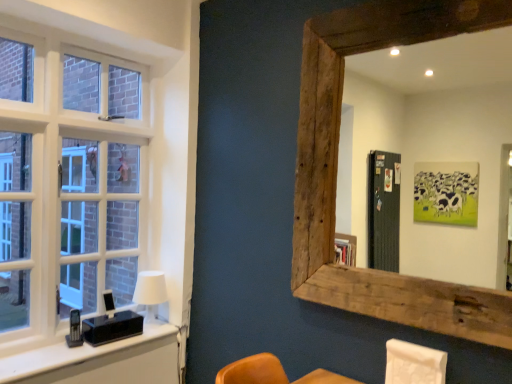
Question: Does white matte table lamp at left appear on the left side of rustic wood mirror at upper right?

Choices:
 (A) yes
 (B) no

Answer: (A)

Question: Is rustic wood mirror at upper right located within white matte table lamp at left?

Choices:
 (A) no
 (B) yes

Answer: (A)

Question: Is white matte table lamp at left bigger than rustic wood mirror at upper right?

Choices:
 (A) yes
 (B) no

Answer: (B)

Question: Considering the relative sizes of white matte table lamp at left and rustic wood mirror at upper right in the image provided, is white matte table lamp at left shorter than rustic wood mirror at upper right?

Choices:
 (A) no
 (B) yes

Answer: (B)

Question: From the image's perspective, is white matte table lamp at left under rustic wood mirror at upper right?

Choices:
 (A) yes
 (B) no

Answer: (A)

Question: Is white fabric swivel chair at lower right bigger or smaller than rustic wood mirror at upper right?

Choices:
 (A) big
 (B) small

Answer: (B)

Question: Considering the positions of point (438, 372) and point (432, 102), is point (438, 372) closer or farther from the camera than point (432, 102)?

Choices:
 (A) farther
 (B) closer

Answer: (B)

Question: From a real-world perspective, is white fabric swivel chair at lower right physically located above or below rustic wood mirror at upper right?

Choices:
 (A) above
 (B) below

Answer: (B)

Question: Would you say white fabric swivel chair at lower right is inside or outside rustic wood mirror at upper right?

Choices:
 (A) inside
 (B) outside

Answer: (B)

Question: In terms of height, does white fabric swivel chair at lower right look taller or shorter compared to white matte table lamp at left?

Choices:
 (A) short
 (B) tall

Answer: (A)

Question: Is point (394, 349) positioned closer to the camera than point (144, 279)?

Choices:
 (A) farther
 (B) closer

Answer: (B)

Question: In terms of width, does white fabric swivel chair at lower right look wider or thinner when compared to white matte table lamp at left?

Choices:
 (A) wide
 (B) thin

Answer: (B)

Question: From a real-world perspective, is white fabric swivel chair at lower right positioned above or below white matte table lamp at left?

Choices:
 (A) above
 (B) below

Answer: (B)

Question: Is white matte table lamp at left taller or shorter than white fabric swivel chair at lower right?

Choices:
 (A) short
 (B) tall

Answer: (B)

Question: From a real-world perspective, relative to white fabric swivel chair at lower right, is white matte table lamp at left vertically above or below?

Choices:
 (A) above
 (B) below

Answer: (A)